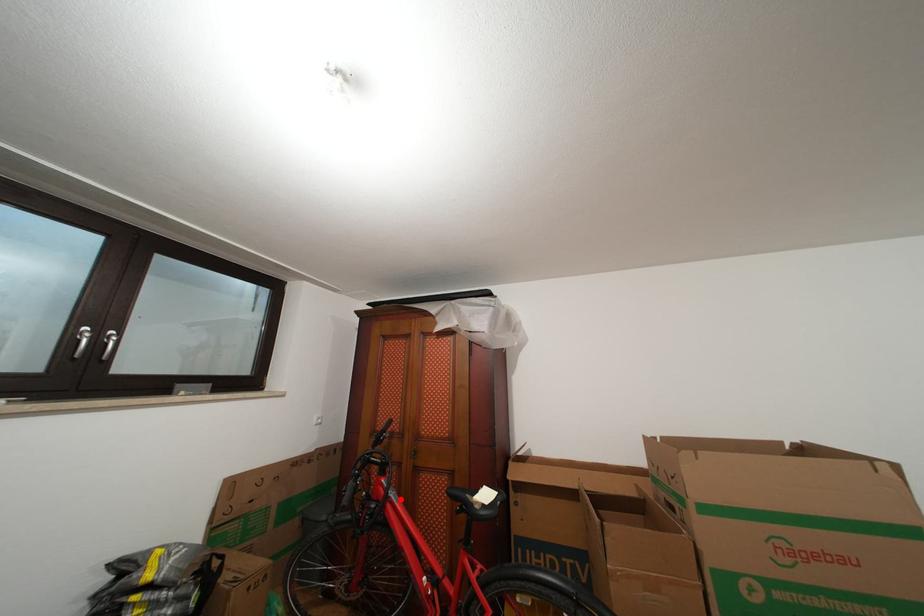
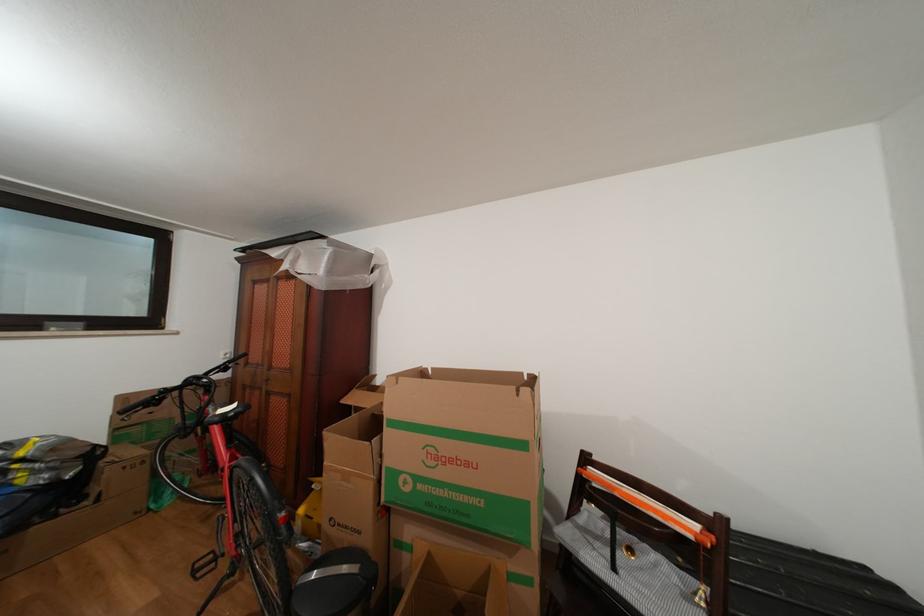
Where in the second image is the point corresponding to the highlighted location from the first image?

(219, 414)